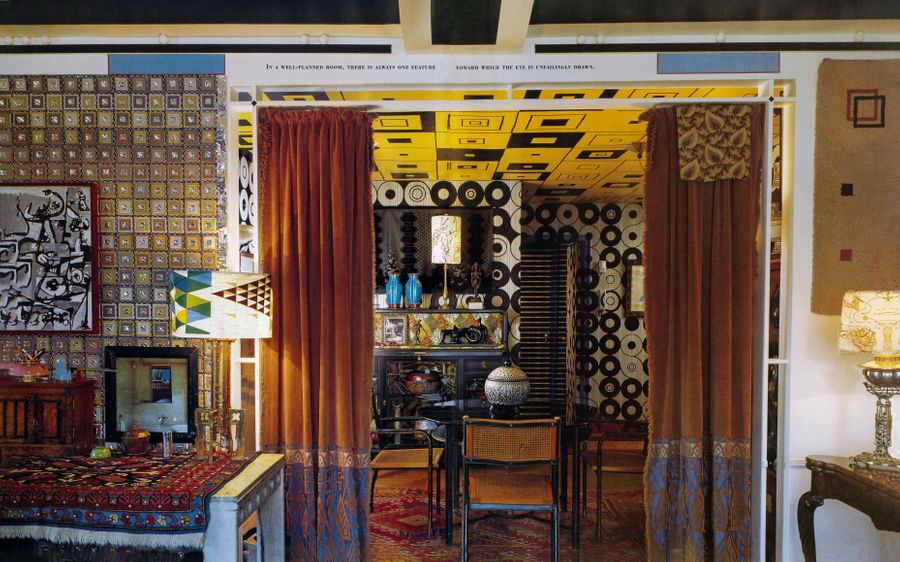
Where is `place to sit`? Image resolution: width=900 pixels, height=562 pixels. place to sit is located at coordinates (505, 489), (605, 464), (411, 455).